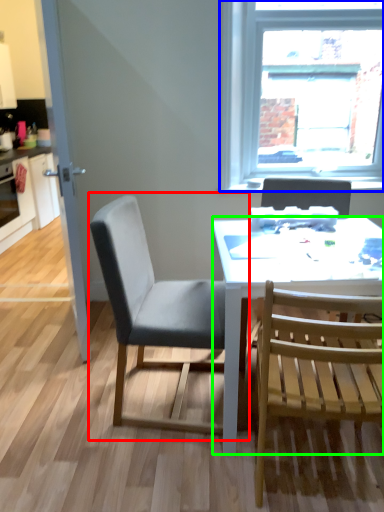
Question: Which is nearer to the chair (highlighted by a red box)? window (highlighted by a blue box) or desk (highlighted by a green box).

Choices:
 (A) window
 (B) desk

Answer: (B)